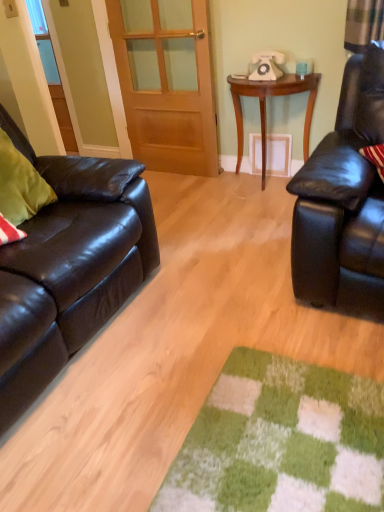
Where is `free space in front of wooden table at center`? free space in front of wooden table at center is located at coordinates (256, 209).